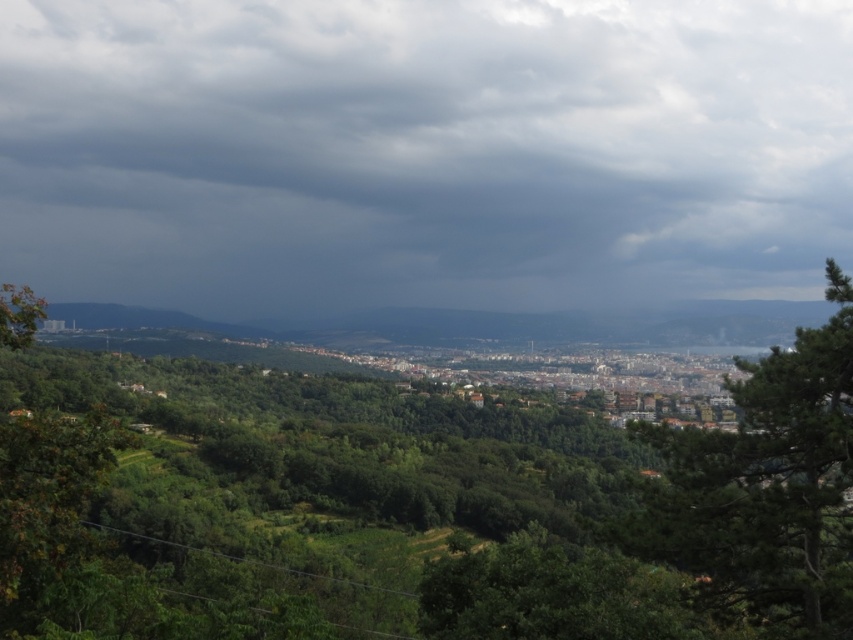
You are a drone operator trying to navigate your drone through the scene. The drone must avoid obstacles and stay within the frame. Given the coordinates of the dark gray cloud at upper center, can you confirm if the drone can safely pass below it without going out of the frame?

The dark gray cloud at upper center is located at coordinates point (422, 154). Since the drone must stay within the frame, it can safely pass below the cloud as long as it maintains its position within the image boundaries.